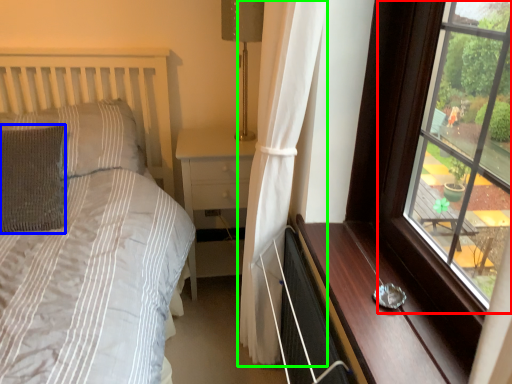
Question: Which object is positioned farthest from window (highlighted by a red box)? Select from pillow (highlighted by a blue box) and curtain (highlighted by a green box).

Choices:
 (A) pillow
 (B) curtain

Answer: (A)